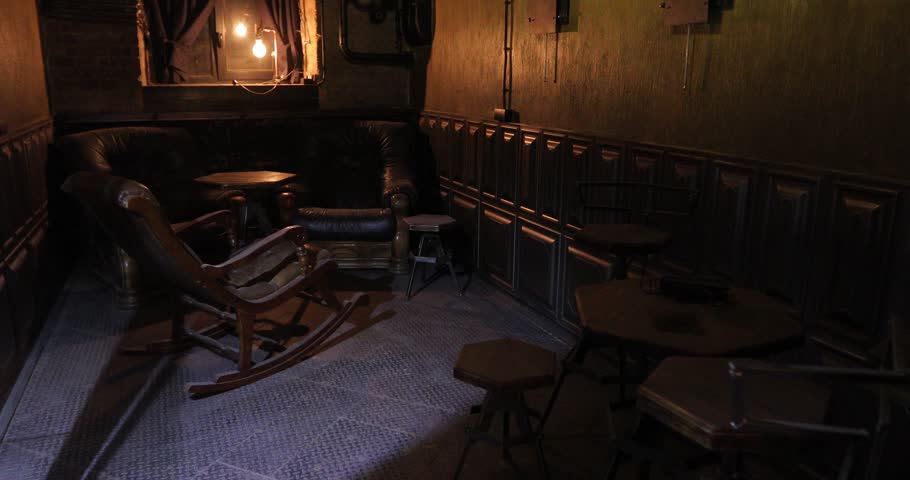
Locate an element on the screen. This screenshot has width=910, height=480. wall is located at coordinates (782, 61).